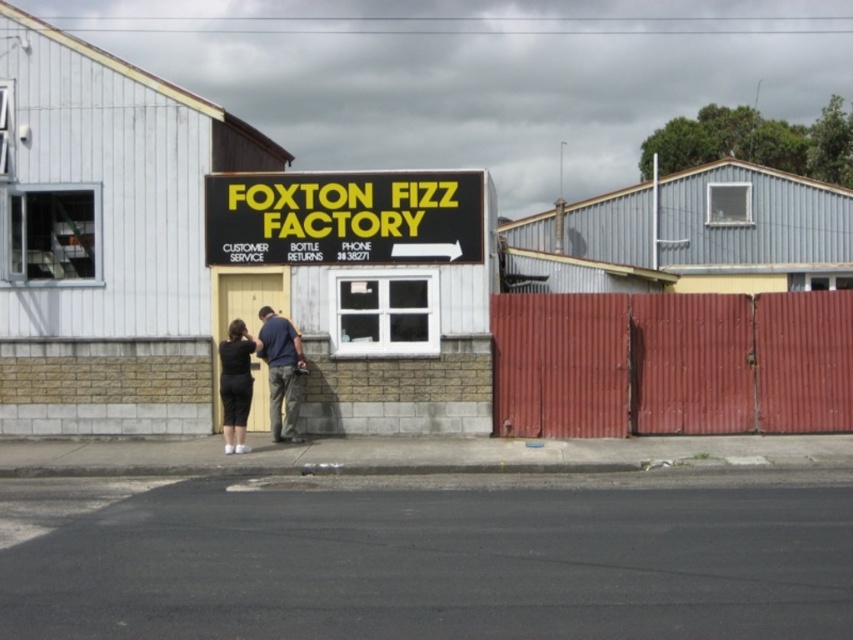
Between black plastic sign at center and dark blue shirt at center, which one has more height?

dark blue shirt at center is taller.

Is black plastic sign at center thinner than dark blue shirt at center?

In fact, black plastic sign at center might be wider than dark blue shirt at center.

Is point (383, 182) farther from viewer compared to point (293, 369)?

Yes.

Locate an element on the screen. black plastic sign at center is located at coordinates (343, 218).

Can you confirm if black matte sign at center is shorter than black matte dress at lower center?

Incorrect, black matte sign at center's height does not fall short of black matte dress at lower center's.

Can you confirm if black matte sign at center is smaller than black matte dress at lower center?

Actually, black matte sign at center might be larger than black matte dress at lower center.

This screenshot has width=853, height=640. I want to click on black matte sign at center, so click(366, 289).

Is black matte sign at center to the right of dark blue shirt at center from the viewer's perspective?

Correct, you'll find black matte sign at center to the right of dark blue shirt at center.

Between point (407, 310) and point (294, 385), which one is positioned behind?

The point (407, 310) is behind.

Locate an element on the screen. The width and height of the screenshot is (853, 640). black matte sign at center is located at coordinates (366, 289).